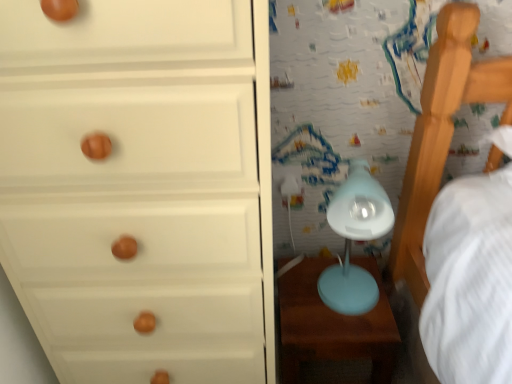
Identify the location of matte blue table lamp at center-right. The image size is (512, 384). (355, 239).

Find the location of a particular element. This screenshot has width=512, height=384. white matte chest of drawers at left is located at coordinates (138, 185).

From the image's perspective, is matte blue table at lower right located beneath white matte chest of drawers at left?

Yes, from the image's perspective, matte blue table at lower right is below white matte chest of drawers at left.

From a real-world perspective, is matte blue table at lower right on white matte chest of drawers at left?

No.

Does point (341, 335) appear closer or farther from the camera than point (143, 135)?

Point (341, 335) is farther from the camera than point (143, 135).

Considering the sizes of objects matte blue table at lower right and white matte chest of drawers at left in the image provided, who is thinner, matte blue table at lower right or white matte chest of drawers at left?

Thinner between the two is matte blue table at lower right.

How different are the orientations of matte blue table at lower right and matte blue table lamp at center-right in degrees?

0.00415 degrees.

From the picture: Is matte blue table at lower right looking in the opposite direction of matte blue table lamp at center-right?

matte blue table at lower right is not turned away from matte blue table lamp at center-right.

Does matte blue table at lower right have a lesser width compared to matte blue table lamp at center-right?

Incorrect, the width of matte blue table at lower right is not less than that of matte blue table lamp at center-right.

From a real-world perspective, between matte blue table at lower right and matte blue table lamp at center-right, who is vertically lower?

matte blue table at lower right, from a real-world perspective.

Between white matte chest of drawers at left and matte blue table at lower right, which one is positioned in front?

white matte chest of drawers at left.

Could matte blue table at lower right be considered to be inside white matte chest of drawers at left?

Actually, matte blue table at lower right is outside white matte chest of drawers at left.

Considering the positions of point (134, 13) and point (354, 317), is point (134, 13) closer or farther from the camera than point (354, 317)?

Point (134, 13) appears to be closer to the viewer than point (354, 317).

Is matte blue table lamp at center-right far from matte blue table at lower right?

No, there isn't a large distance between matte blue table lamp at center-right and matte blue table at lower right.

Does matte blue table lamp at center-right come behind matte blue table at lower right?

No, it is in front of matte blue table at lower right.

This screenshot has height=384, width=512. Find the location of `table lamp on the right side of matte blue table at lower right`. table lamp on the right side of matte blue table at lower right is located at coordinates (355, 239).

Is matte blue table lamp at center-right to the left or to the right of matte blue table at lower right in the image?

Based on their positions, matte blue table lamp at center-right is located to the right of matte blue table at lower right.

Is white matte chest of drawers at left positioned with its back to matte blue table lamp at center-right?

That's not correct — white matte chest of drawers at left is not looking away from matte blue table lamp at center-right.

Locate an element on the screen. This screenshot has width=512, height=384. chest of drawers below the matte blue table lamp at center-right (from the image's perspective) is located at coordinates point(138,185).

From a real-world perspective, relative to matte blue table lamp at center-right, is white matte chest of drawers at left vertically above or below?

From a real-world perspective, white matte chest of drawers at left is physically above matte blue table lamp at center-right.

Between white matte chest of drawers at left and matte blue table lamp at center-right, which one has smaller size?

Smaller between the two is matte blue table lamp at center-right.

From the image's perspective, is matte blue table lamp at center-right on top of white matte chest of drawers at left?

Yes, from the image's perspective, matte blue table lamp at center-right is on top of white matte chest of drawers at left.

Considering the relative sizes of matte blue table lamp at center-right and white matte chest of drawers at left in the image provided, is matte blue table lamp at center-right thinner than white matte chest of drawers at left?

Yes, matte blue table lamp at center-right is thinner than white matte chest of drawers at left.

Between matte blue table lamp at center-right and white matte chest of drawers at left, which one has more height?

Standing taller between the two is white matte chest of drawers at left.

Where is `table behind the white matte chest of drawers at left`? The height and width of the screenshot is (384, 512). table behind the white matte chest of drawers at left is located at coordinates (332, 325).

Where is `table lamp above the matte blue table at lower right (from a real-world perspective)`? Image resolution: width=512 pixels, height=384 pixels. table lamp above the matte blue table at lower right (from a real-world perspective) is located at coordinates (355, 239).

Considering their positions, is matte blue table lamp at center-right positioned further to matte blue table at lower right than white matte chest of drawers at left?

Based on the image, white matte chest of drawers at left appears to be further to matte blue table at lower right.

Looking at the image, which one is located further to matte blue table lamp at center-right, white matte chest of drawers at left or matte blue table at lower right?

The object further to matte blue table lamp at center-right is white matte chest of drawers at left.

Based on their spatial positions, is matte blue table lamp at center-right or matte blue table at lower right closer to white matte chest of drawers at left?

matte blue table lamp at center-right lies closer to white matte chest of drawers at left than the other object.

Considering their positions, is white matte chest of drawers at left positioned further to matte blue table at lower right than matte blue table lamp at center-right?

white matte chest of drawers at left.

Looking at the image, which one is located closer to matte blue table lamp at center-right, matte blue table at lower right or white matte chest of drawers at left?

Among the two, matte blue table at lower right is located nearer to matte blue table lamp at center-right.

Looking at the image, which one is located closer to white matte chest of drawers at left, matte blue table at lower right or matte blue table lamp at center-right?

matte blue table lamp at center-right lies closer to white matte chest of drawers at left than the other object.

Identify the location of table lamp positioned between white matte chest of drawers at left and matte blue table at lower right from near to far. (355, 239).